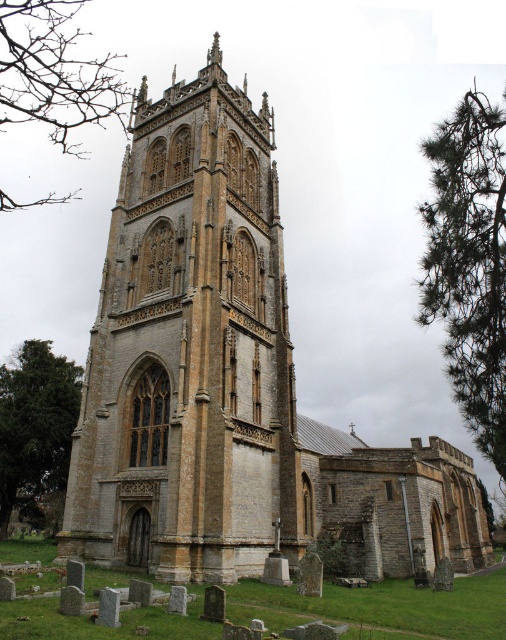
Question: Which point is farther to the camera?

Choices:
 (A) (11, 17)
 (B) (475, 316)
 (C) (124, 240)

Answer: (A)

Question: Is yellow stone tower at center below green textured tree at lower left?

Choices:
 (A) yes
 (B) no

Answer: (B)

Question: Among these objects, which one is nearest to the camera?

Choices:
 (A) green textured tree at lower left
 (B) yellow stone tower at center
 (C) bare branches at upper left

Answer: (B)

Question: Which object is closer to the camera taking this photo?

Choices:
 (A) yellow stone tower at center
 (B) green needle-like leaves at right

Answer: (A)

Question: Is yellow stone tower at center closer to the viewer compared to green needle-like leaves at right?

Choices:
 (A) no
 (B) yes

Answer: (B)

Question: Is bare branches at upper left positioned at the back of green textured tree at lower left?

Choices:
 (A) no
 (B) yes

Answer: (A)